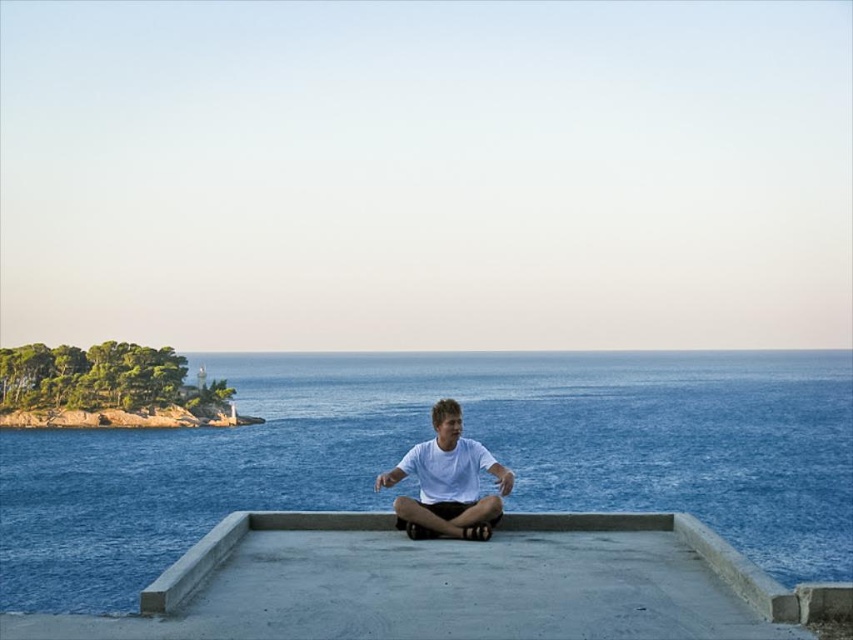
Question: Is blue water at center smaller than white matte shirt at center?

Choices:
 (A) no
 (B) yes

Answer: (A)

Question: Which point is closer to the camera taking this photo?

Choices:
 (A) (189, 593)
 (B) (474, 532)
 (C) (730, 483)

Answer: (A)

Question: Estimate the real-world distances between objects in this image. Which object is closer to the white matte shirt at center?

Choices:
 (A) concrete at center
 (B) blue water at center

Answer: (A)

Question: Is blue water at center bigger than white matte shirt at center?

Choices:
 (A) no
 (B) yes

Answer: (B)

Question: Is concrete at center smaller than white matte shirt at center?

Choices:
 (A) yes
 (B) no

Answer: (B)

Question: Which point is closer to the camera taking this photo?

Choices:
 (A) (306, 518)
 (B) (814, 467)
 (C) (474, 528)

Answer: (C)